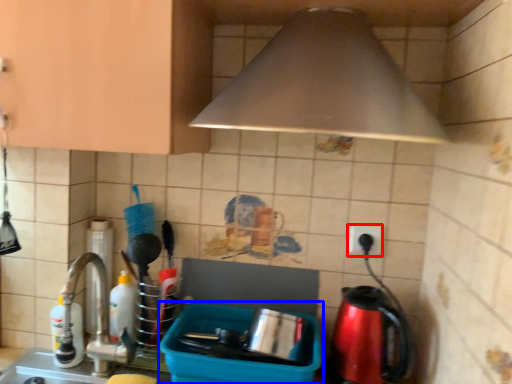
Question: Which point is closer to the camera, electric outlet (highlighted by a red box) or appliance (highlighted by a blue box)?

Choices:
 (A) electric outlet
 (B) appliance

Answer: (B)